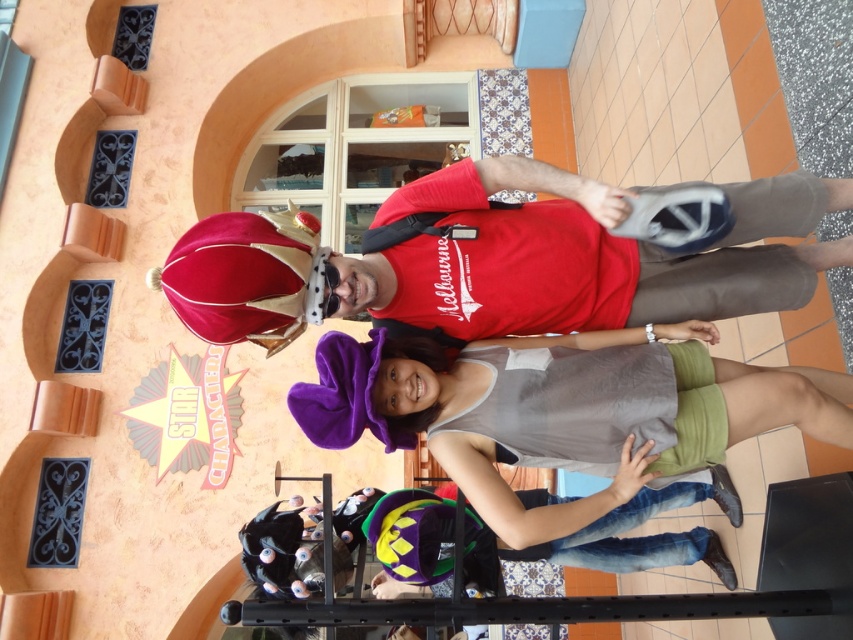
Consider the image. You are a photographer trying to capture a clear shot of both the velvet crown at upper center and the gray fabric tank top at center. Given their heights, which one might appear smaller in the photo?

The velvet crown at upper center appears smaller in the photo because it is not as tall as the gray fabric tank top at center.

You are a costume designer preparing for a play and need to decide which item to place on a mannequin. The velvet crown at upper center and the gray fabric tank top at center are available. Which item should you choose if you want the larger one?

The velvet crown at upper center has a larger size compared to the gray fabric tank top at center, so you should choose the velvet crown at upper center.